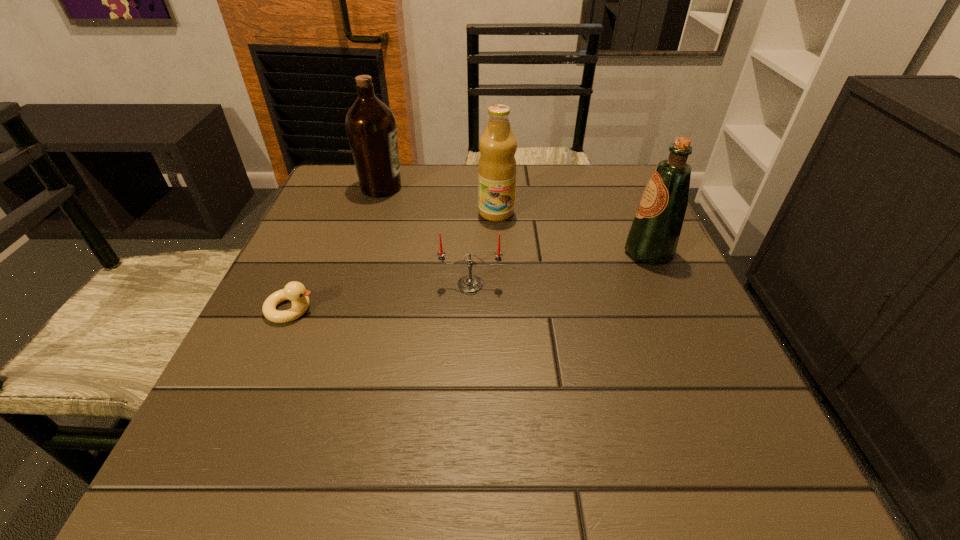
Image resolution: width=960 pixels, height=540 pixels. I want to click on object that is at the far left corner, so click(x=371, y=127).

The width and height of the screenshot is (960, 540). I want to click on blank space at the far edge, so click(533, 174).

Identify the location of blank space at the near edge. The image size is (960, 540). (529, 458).

Locate an element on the screen. Image resolution: width=960 pixels, height=540 pixels. free space at the left edge is located at coordinates (261, 422).

In the image, there is a desktop. At what (x,y) coordinates should I click in order to perform the action: click on vacant space at the right edge. Please return your answer as a coordinate pair (x, y). Looking at the image, I should click on (687, 334).

At what (x,y) coordinates should I click in order to perform the action: click on vacant space at the far left corner of the desktop. Please return your answer as a coordinate pair (x, y). The image size is (960, 540). Looking at the image, I should click on (334, 200).

The height and width of the screenshot is (540, 960). I want to click on vacant space in between the fourth tallest object and the nearest object, so click(x=381, y=297).

Identify the location of vacant point located between the farthest object and the third nearest object. The height and width of the screenshot is (540, 960). (515, 220).

You are a GUI agent. You are given a task and a screenshot of the screen. Output one action in this format:
    pyautogui.click(x=<x>, y=<y>)
    Task: Click on the vacant point located between the fourth nearest object and the leftmost olive oil
    This screenshot has width=960, height=540.
    Given the screenshot: What is the action you would take?
    pyautogui.click(x=439, y=200)

Find the location of a particular element. The height and width of the screenshot is (540, 960). free space between the third farthest object and the fourth farthest object is located at coordinates (560, 268).